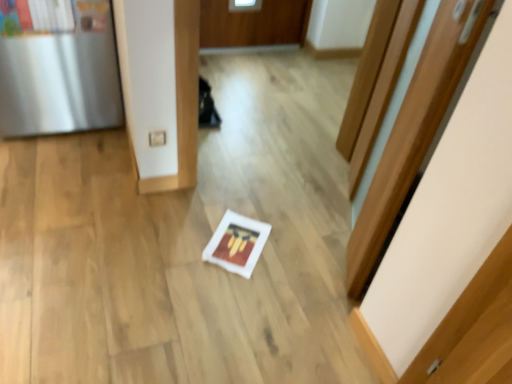
Where is `free space in front of satin silver fridge at left`? This screenshot has width=512, height=384. free space in front of satin silver fridge at left is located at coordinates (59, 176).